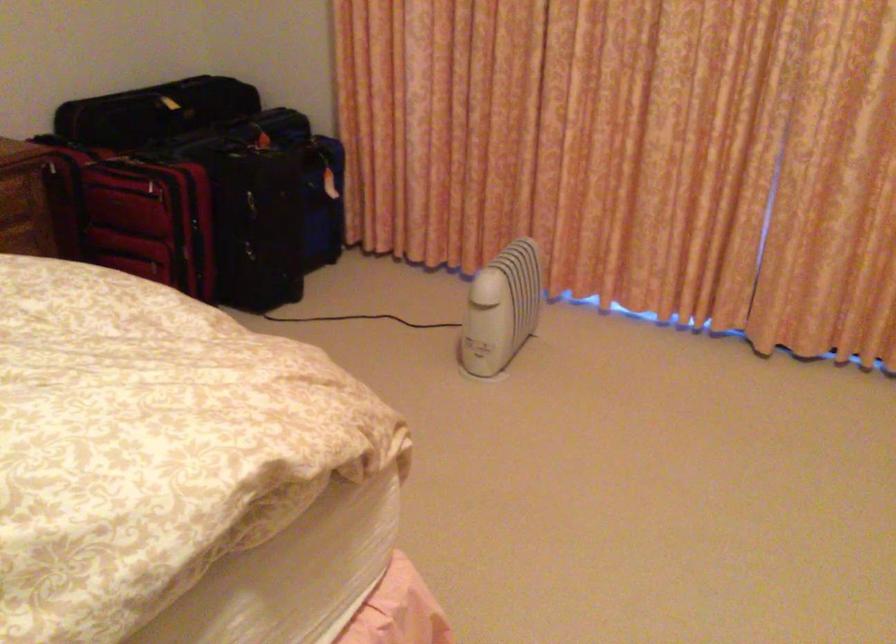
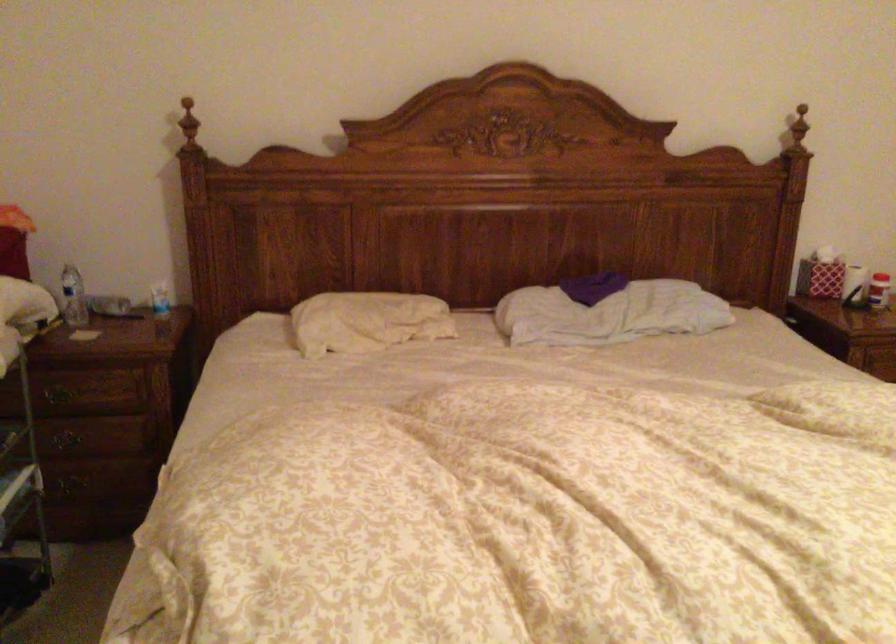
Question: Based on the continuous images, in which direction is the camera rotating? Reply with the corresponding letter.

Choices:
 (A) Left
 (B) Right
 (C) Up
 (D) Down

Answer: (A)